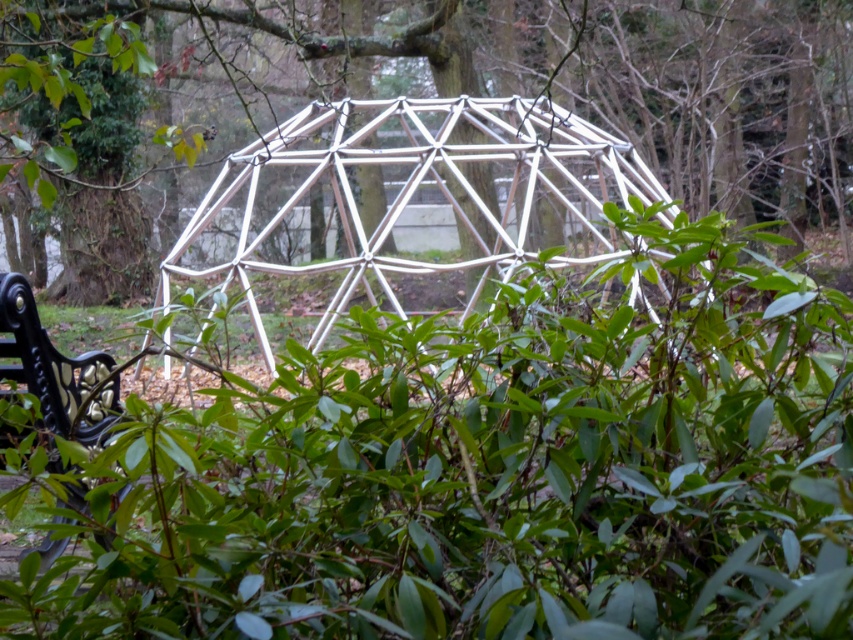
Question: Is green matte bush at center bigger than white metallic geodesic dome at center?

Choices:
 (A) no
 (B) yes

Answer: (A)

Question: Based on their relative distances, which object is nearer to the green matte bush at center?

Choices:
 (A) white metallic geodesic dome at center
 (B) green leafy tree at center

Answer: (A)

Question: Which point is farther from the camera taking this photo?

Choices:
 (A) (703, 433)
 (B) (357, 64)

Answer: (B)

Question: Considering the real-world distances, which object is closest to the green leafy tree at center?

Choices:
 (A) green matte bush at center
 (B) white metallic geodesic dome at center

Answer: (B)

Question: Is green matte bush at center to the left of white metallic geodesic dome at center from the viewer's perspective?

Choices:
 (A) no
 (B) yes

Answer: (A)

Question: Is green leafy tree at center wider than white metallic geodesic dome at center?

Choices:
 (A) no
 (B) yes

Answer: (B)